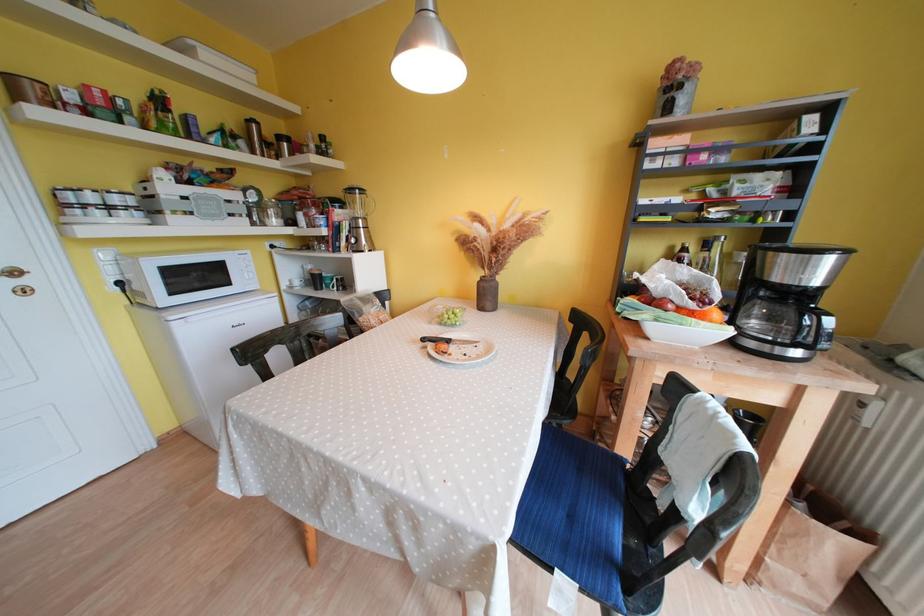
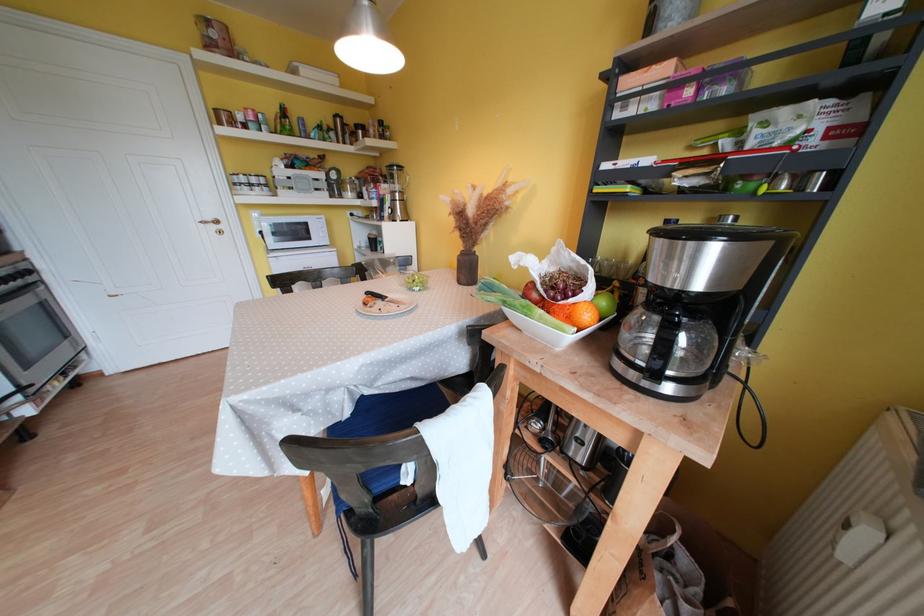
In the second image, find the point that corresponds to pixel 796 291 in the first image.

(669, 292)